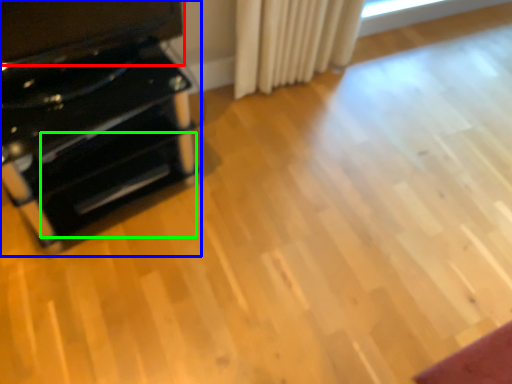
Question: Considering the real-world distances, which object is closest to wide (highlighted by a red box)? furniture (highlighted by a blue box) or drawer (highlighted by a green box).

Choices:
 (A) furniture
 (B) drawer

Answer: (A)